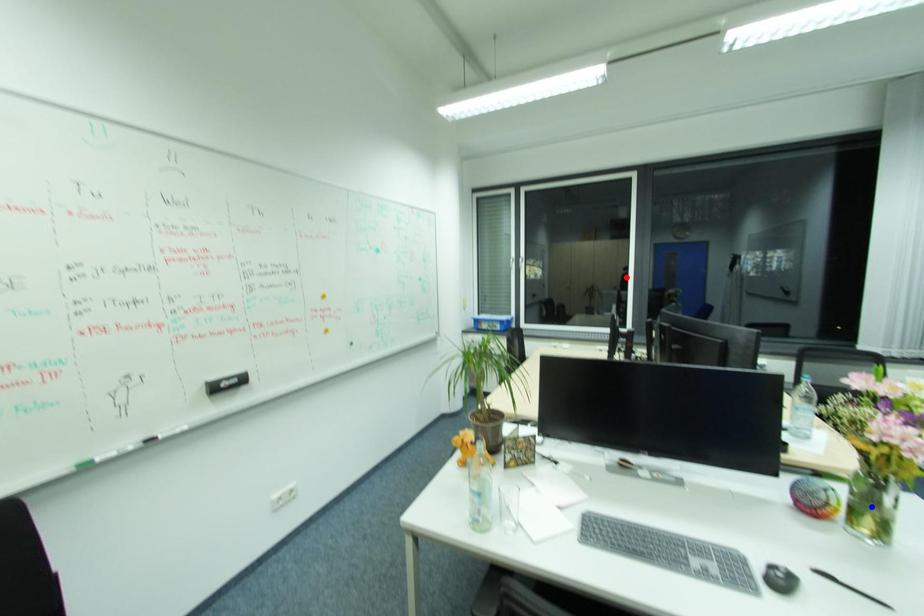
Question: Which of the two points in the image is closer to the camera?

Choices:
 (A) Blue point is closer.
 (B) Red point is closer.

Answer: (A)